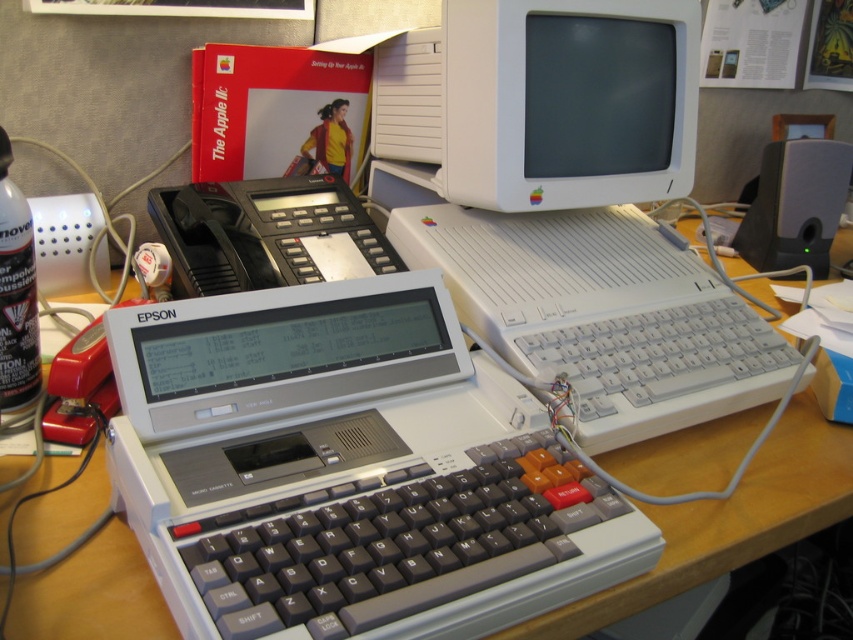
Question: Which point appears farthest from the camera in this image?

Choices:
 (A) (62, 502)
 (B) (30, 323)
 (C) (241, 189)
 (D) (653, 129)

Answer: (D)

Question: Among these points, which one is farthest from the camera?

Choices:
 (A) (509, 16)
 (B) (187, 269)
 (C) (569, 632)

Answer: (B)

Question: Where is wooden desk at center located in relation to transparent plastic canister at left in the image?

Choices:
 (A) above
 (B) below

Answer: (B)

Question: Can you confirm if white plastic monitor at upper center is positioned to the right of black plastic phone at center?

Choices:
 (A) no
 (B) yes

Answer: (B)

Question: Among these points, which one is nearest to the camera?

Choices:
 (A) (753, 486)
 (B) (268, 252)

Answer: (A)

Question: Can you confirm if white plastic computer at upper center is smaller than black plastic phone at center?

Choices:
 (A) no
 (B) yes

Answer: (A)